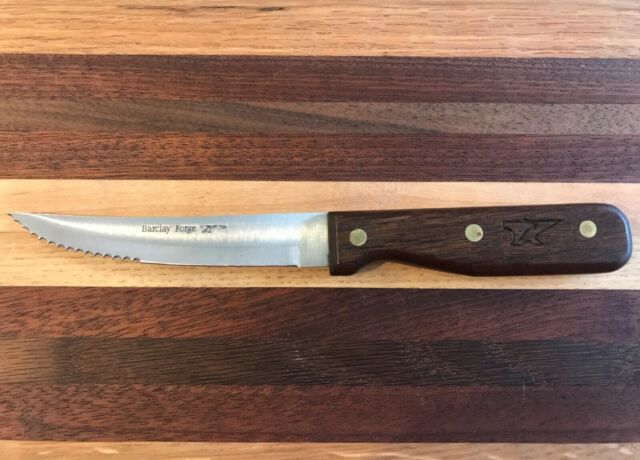
Where is `table`? table is located at coordinates (310, 342).